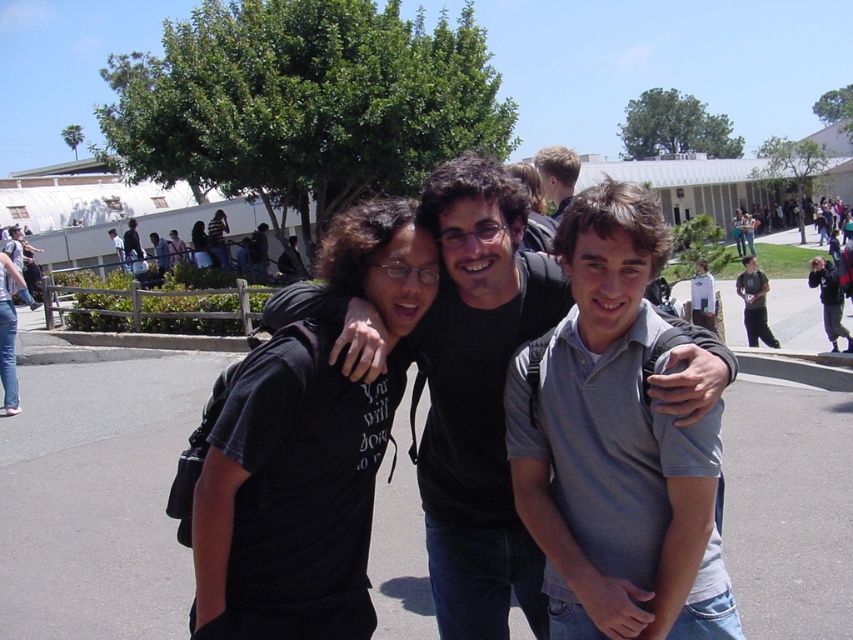
Who is positioned more to the right, gray cotton polo shirt at center or light brown hair at upper center?

From the viewer's perspective, light brown hair at upper center appears more on the right side.

What are the coordinates of `gray cotton polo shirt at center` in the screenshot? It's located at click(616, 445).

I want to click on gray cotton polo shirt at center, so click(616, 445).

Does point (479, 349) come farther from viewer compared to point (740, 284)?

No, it is not.

Is point (490, 339) less distant than point (750, 288)?

Yes, point (490, 339) is in front of point (750, 288).

The image size is (853, 640). Find the location of `black matte shirt at center`. black matte shirt at center is located at coordinates (479, 396).

This screenshot has height=640, width=853. I want to click on black matte shirt at center, so click(x=479, y=396).

Does gray cotton polo shirt at center appear on the right side of dark gray shirt at center?

No, gray cotton polo shirt at center is not to the right of dark gray shirt at center.

Is gray cotton polo shirt at center taller than dark gray shirt at center?

No.

Who is more distant from viewer, [563,620] or [759,339]?

Positioned behind is point [759,339].

At what (x,y) coordinates should I click in order to perform the action: click on gray cotton polo shirt at center. Please return your answer as a coordinate pair (x, y). The image size is (853, 640). Looking at the image, I should click on (x=616, y=445).